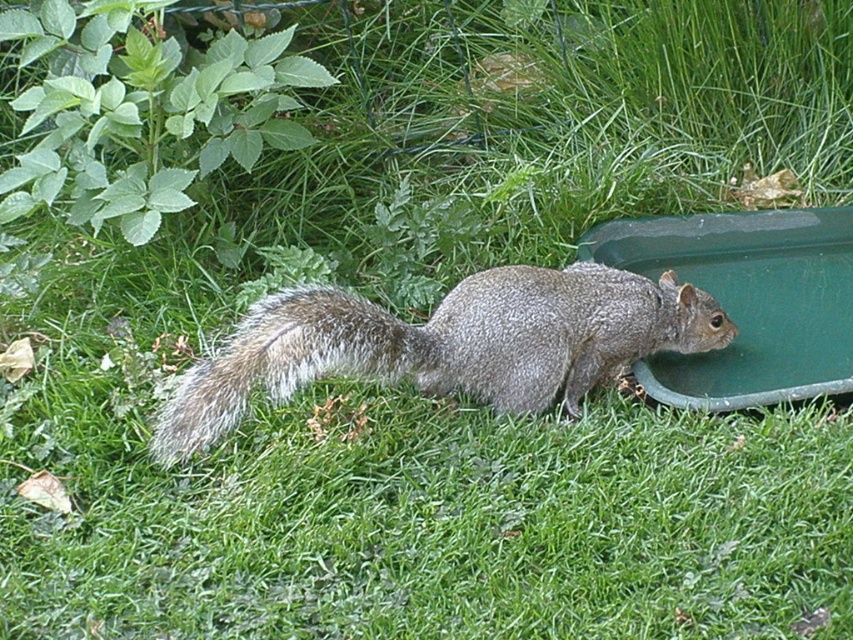
Question: Which of the following is the closest to the observer?

Choices:
 (A) green plastic tray at lower right
 (B) gray furry squirrel at center
 (C) fuzzy gray tail at center

Answer: (C)

Question: Does green plastic tray at lower right come behind fuzzy gray tail at center?

Choices:
 (A) no
 (B) yes

Answer: (B)

Question: Does gray furry squirrel at center have a greater width compared to green plastic tray at lower right?

Choices:
 (A) no
 (B) yes

Answer: (B)

Question: Which object is positioned closest to the fuzzy gray tail at center?

Choices:
 (A) gray furry squirrel at center
 (B) green plastic tray at lower right

Answer: (A)

Question: Does green plastic tray at lower right appear over fuzzy gray tail at center?

Choices:
 (A) no
 (B) yes

Answer: (B)

Question: Based on their relative distances, which object is farther from the green plastic tray at lower right?

Choices:
 (A) fuzzy gray tail at center
 (B) gray furry squirrel at center

Answer: (A)